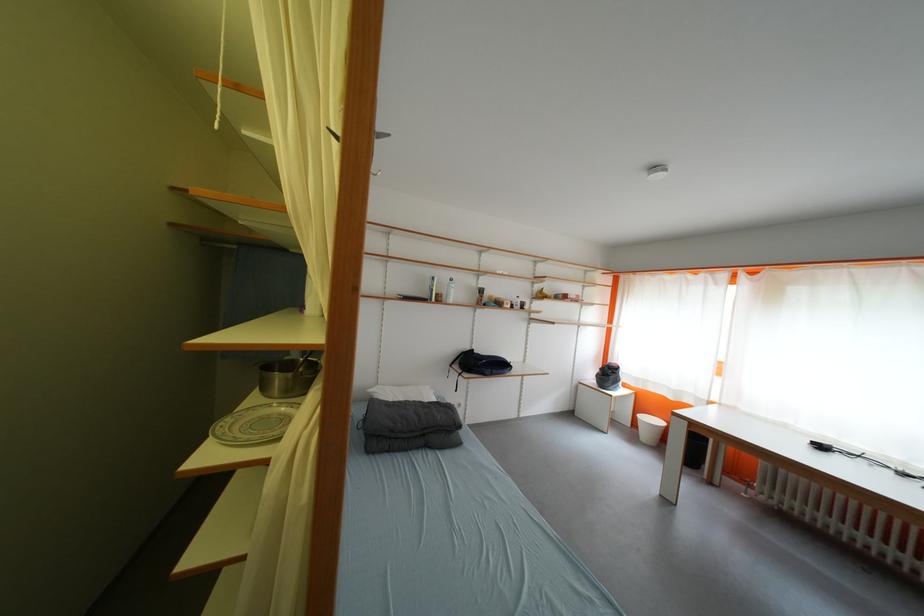
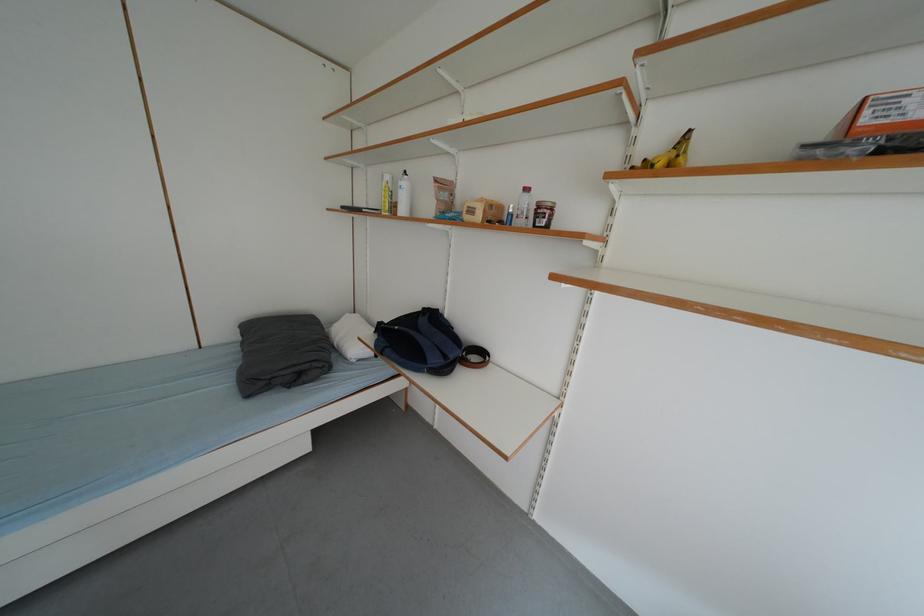
Find the pixel in the second image that matches (x=517, y=310) in the first image.

(487, 220)